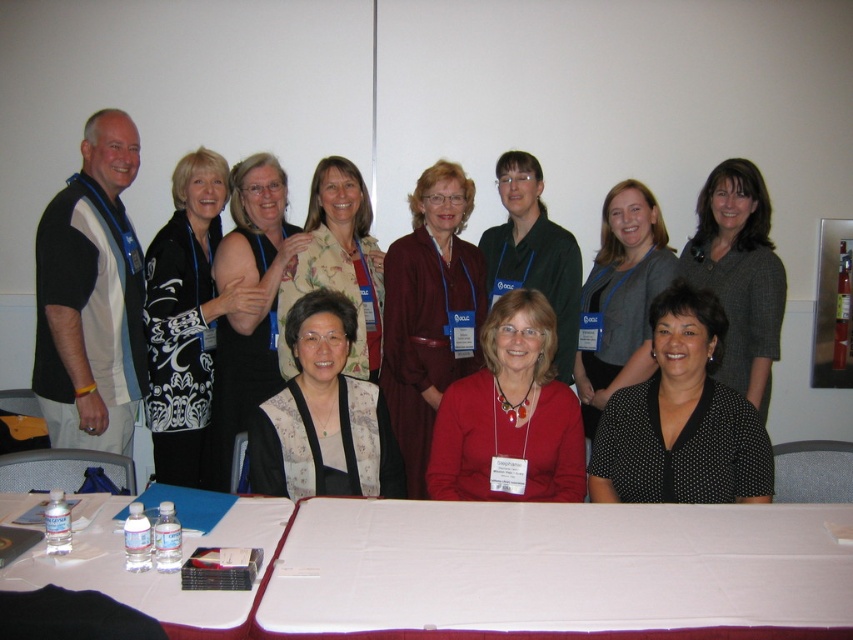
You are a photographer taking a group photo. You notice the black jersey at left and the black dotted blouse at lower center. Which clothing item is positioned higher in the image?

The black jersey at left is located above the black dotted blouse at lower center, so it is positioned higher in the image.

You are a photographer setting up for a group photo. You have a white fabric tablecloth at lower center and a black dotted blouse at lower center in your frame. Which object is wider in the image?

The white fabric tablecloth at lower center is wider than the black dotted blouse at lower center.